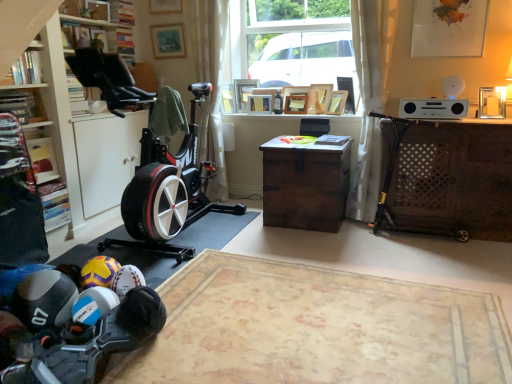
Identify the location of free space between brown wooden desk at center, the 1th desk in the left-to-right sequence, and rubberized black dumbbells at lower left. (237, 274).